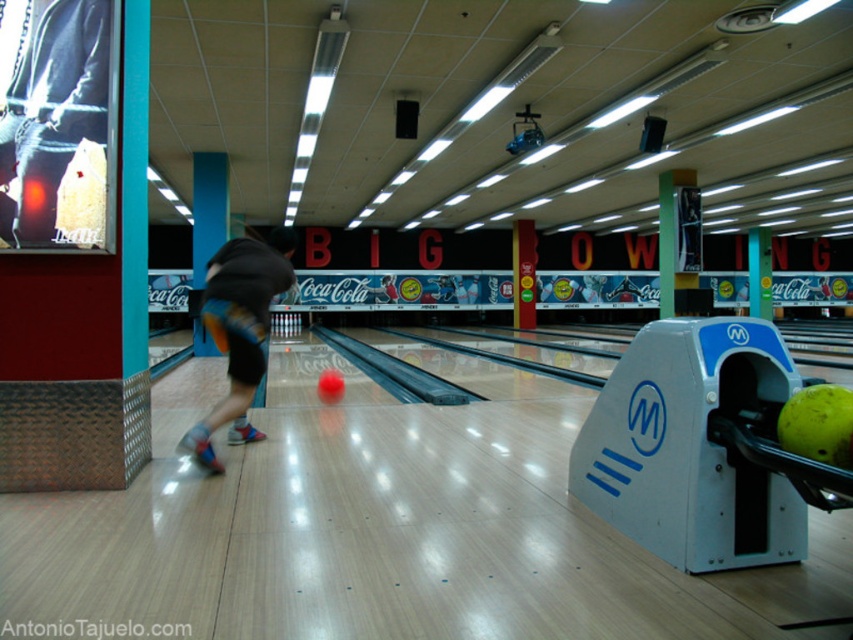
Question: Is denim shorts at center thinner than green matte bowling ball at lower right?

Choices:
 (A) yes
 (B) no

Answer: (B)

Question: Is blue striped shorts at center thinner than green matte bowling ball at lower right?

Choices:
 (A) yes
 (B) no

Answer: (B)

Question: In this image, where is denim shorts at center located relative to yellow matte bowling ball at center?

Choices:
 (A) below
 (B) above

Answer: (B)

Question: Which of these objects is positioned farthest from the green matte bowling ball at lower right?

Choices:
 (A) yellow matte bowling ball at center
 (B) blue striped shorts at center
 (C) denim shorts at center

Answer: (A)

Question: Which is nearer to the green matte bowling ball at lower right?

Choices:
 (A) blue striped shorts at center
 (B) denim shorts at center
 (C) yellow matte bowling ball at center

Answer: (A)

Question: Which point is farther to the camera?

Choices:
 (A) yellow matte bowling ball at center
 (B) green matte bowling ball at lower right
 (C) denim shorts at center
 (D) blue striped shorts at center

Answer: (A)